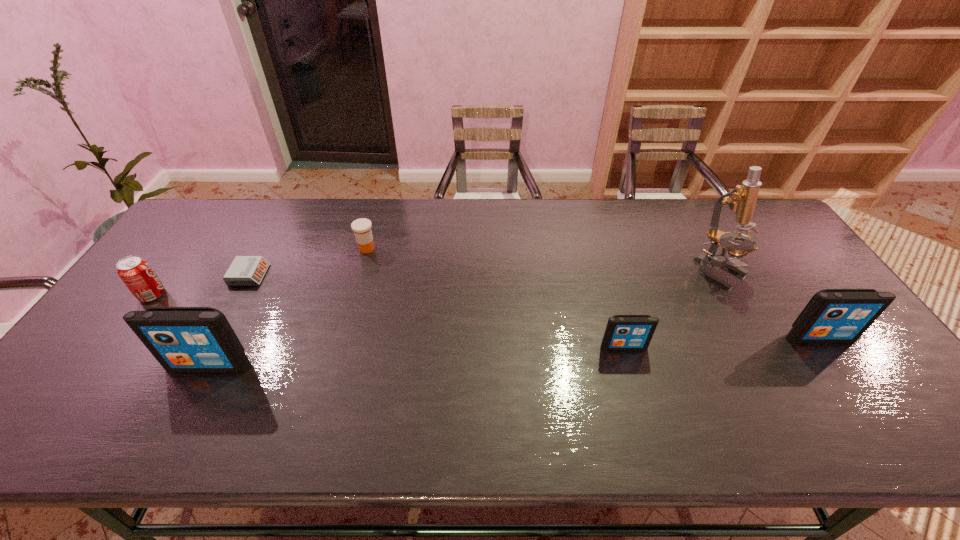
The width and height of the screenshot is (960, 540). I want to click on object that is at the right edge, so click(x=832, y=315).

Find the location of `vacant position at the far edge of the desktop`. vacant position at the far edge of the desktop is located at coordinates (414, 200).

The height and width of the screenshot is (540, 960). I want to click on vacant region at the near edge of the desktop, so click(x=563, y=373).

This screenshot has height=540, width=960. What are the coordinates of `free point at the right edge` in the screenshot? It's located at click(773, 294).

In the image, there is a desktop. Where is `free space at the far left corner`? free space at the far left corner is located at coordinates (184, 227).

I want to click on vacant space in between the shortest object and the second iPod from left to right, so pos(437,310).

This screenshot has width=960, height=540. Find the location of `empty space between the second shortest iPod and the farthest object`. empty space between the second shortest iPod and the farthest object is located at coordinates (593, 293).

The image size is (960, 540). Identify the location of empty location between the shortest iPod and the shortest object. [x=437, y=310].

In order to click on vacant space that is in between the medicine and the alarm clock in this screenshot , I will do `click(308, 261)`.

Image resolution: width=960 pixels, height=540 pixels. I want to click on blank region between the alarm clock and the second iPod from left to right, so coord(437,310).